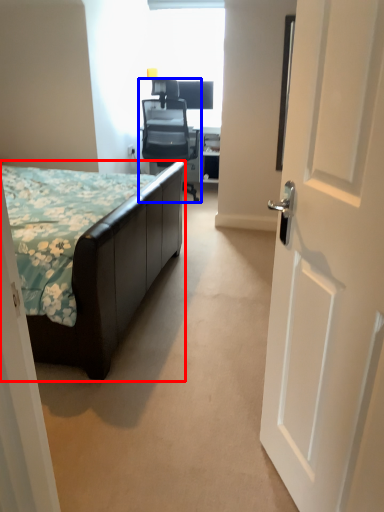
Question: Which object is further to the camera taking this photo, bed (highlighted by a red box) or chair (highlighted by a blue box)?

Choices:
 (A) bed
 (B) chair

Answer: (B)